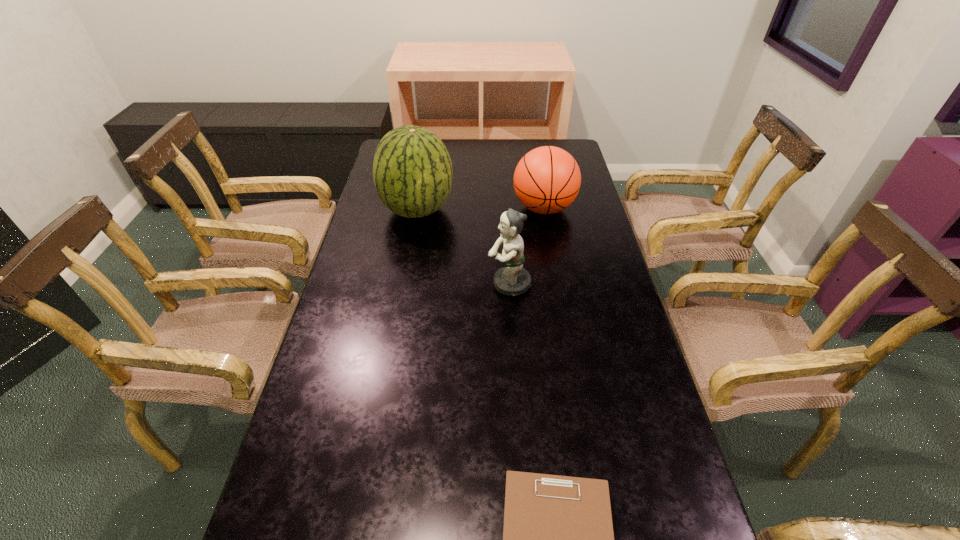
Locate an element on the screen. The width and height of the screenshot is (960, 540). watermelon is located at coordinates (412, 170).

Where is `the leftmost object`? the leftmost object is located at coordinates (412, 170).

Locate an element on the screen. the second nearest object is located at coordinates (512, 279).

Where is `basketball`? basketball is located at coordinates (547, 179).

You are a GUI agent. You are given a task and a screenshot of the screen. Output one action in this format:
    pyautogui.click(x=<x>, y=<y>)
    Task: Click on the free space located 0.400m on the front of the watermelon
    This screenshot has width=960, height=540.
    Given the screenshot: What is the action you would take?
    pyautogui.click(x=397, y=325)

I want to click on free location located 0.160m on the front-facing side of the figurine, so click(x=433, y=284).

Image resolution: width=960 pixels, height=540 pixels. What are the coordinates of `vacant space located on the front-facing side of the figurine` in the screenshot? It's located at (444, 284).

Identify the location of vacant space located on the front-facing side of the figurine. This screenshot has width=960, height=540. (461, 284).

I want to click on free space located 0.260m on the back of the basketball, so click(535, 156).

Identify the location of object present at the left edge. (412, 170).